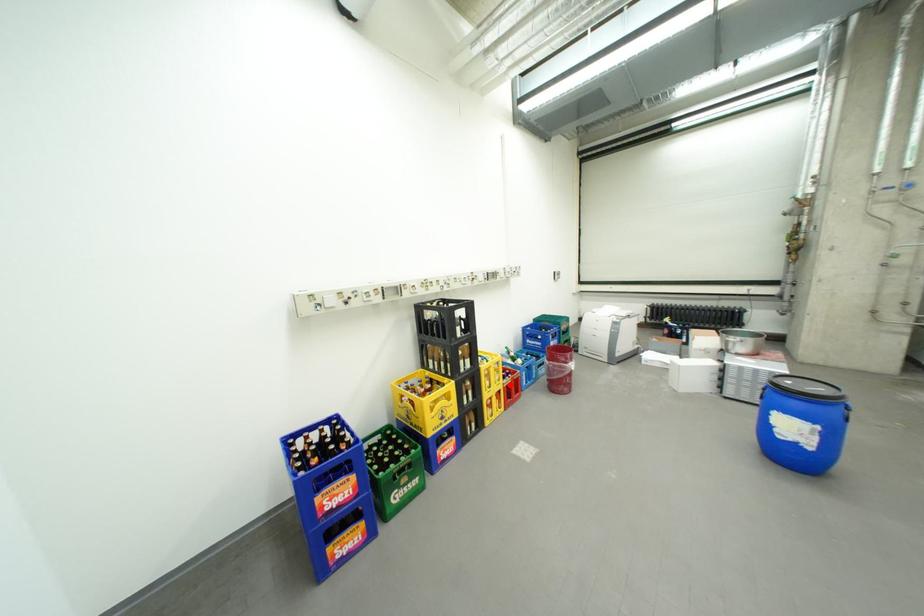
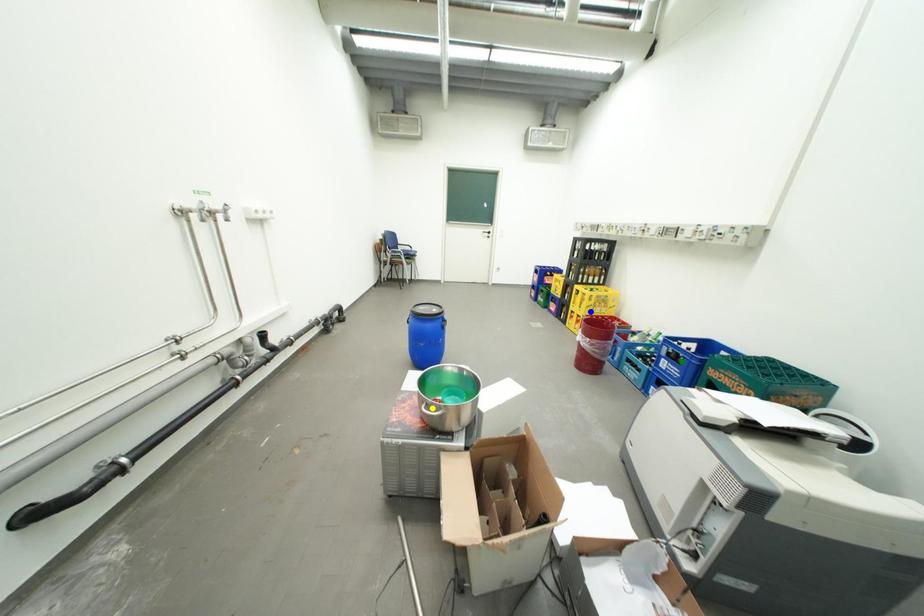
Question: I am providing you with two images of the same scene from different viewpoints. A red point is marked on the first image. You are given multiple points on the second image. Which point in image 2 represents the same 3d spot as the red point in image 1?

Choices:
 (A) green point
 (B) yellow point
 (C) blue point

Answer: (C)